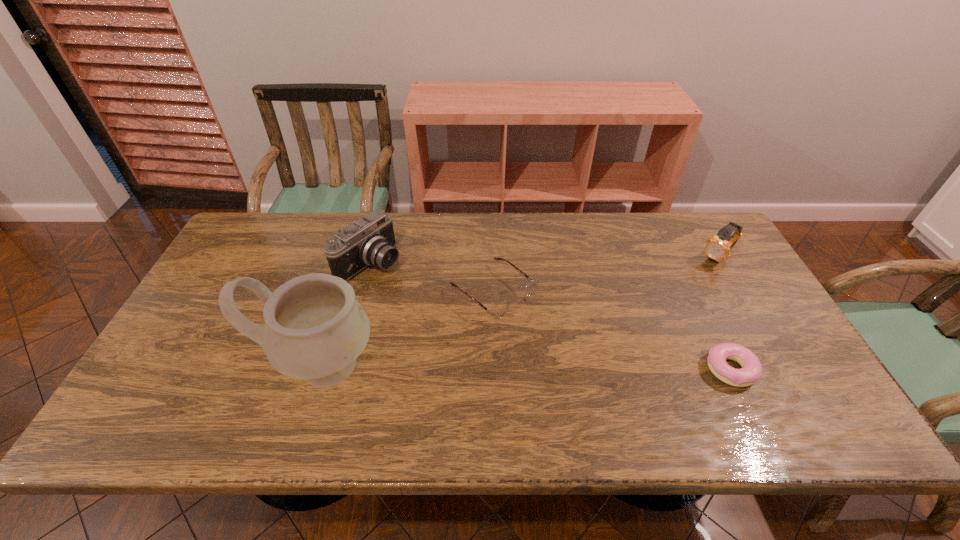
Where is `free space at the right edge of the desktop`? The image size is (960, 540). free space at the right edge of the desktop is located at coordinates (690, 267).

You are a GUI agent. You are given a task and a screenshot of the screen. Output one action in this format:
    pyautogui.click(x=<x>, y=<y>)
    Task: Click on the vacant space at the near right corner of the desktop
    This screenshot has width=960, height=540.
    Given the screenshot: What is the action you would take?
    pyautogui.click(x=764, y=392)

The image size is (960, 540). I want to click on free point between the second object from right to left and the rightmost object, so 724,314.

Locate an element on the screen. The height and width of the screenshot is (540, 960). vacant point located between the second tallest object and the spectacles is located at coordinates (431, 277).

Where is `unoccupied area between the camera and the fourth tallest object`? Image resolution: width=960 pixels, height=540 pixels. unoccupied area between the camera and the fourth tallest object is located at coordinates (431, 277).

Identify the location of empty space between the fourth shortest object and the fourth object from left to right. (550, 316).

Locate an element on the screen. Image resolution: width=960 pixels, height=540 pixels. vacant area between the second object from right to left and the tallest object is located at coordinates (524, 368).

At what (x,y) coordinates should I click in order to perform the action: click on vacant region between the fourth shortest object and the shortest object. Please return your answer as a coordinate pair (x, y). Looking at the image, I should click on (550, 316).

Locate an element on the screen. empty space that is in between the spectacles and the second tallest object is located at coordinates (431, 277).

You are a GUI agent. You are given a task and a screenshot of the screen. Output one action in this format:
    pyautogui.click(x=<x>, y=<y>)
    Task: Click on the free point between the spectacles and the third shortest object
    
    Given the screenshot: What is the action you would take?
    pyautogui.click(x=605, y=275)